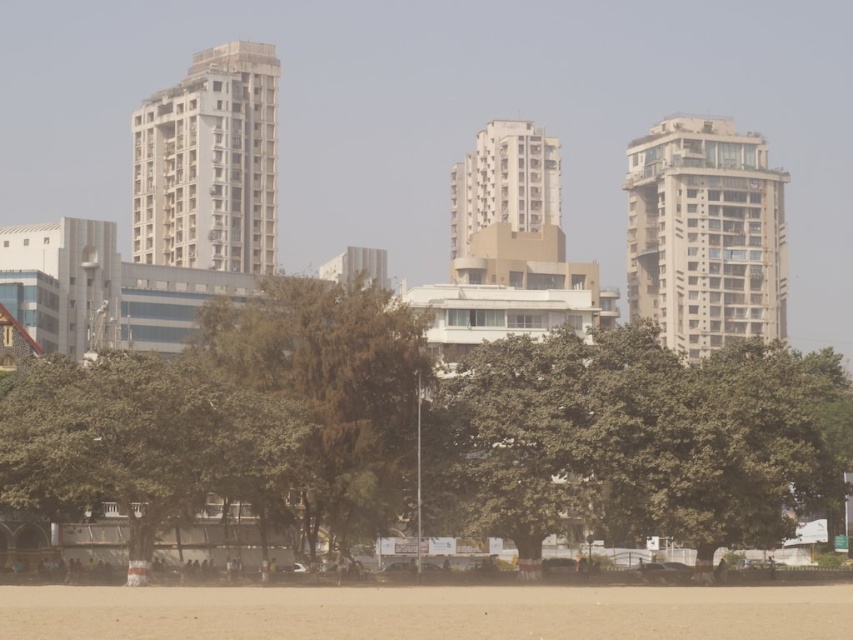
Question: Which object is the farthest from the white concrete building at upper right?

Choices:
 (A) beige concrete building at center
 (B) green leafy tree at center

Answer: (B)

Question: Can you confirm if brown sandy dirt field at lower center is smaller than white concrete building at upper right?

Choices:
 (A) no
 (B) yes

Answer: (B)

Question: Is green leafy tree at center above beige concrete building at center?

Choices:
 (A) no
 (B) yes

Answer: (A)

Question: Which is farther from the white concrete building at center?

Choices:
 (A) brown sandy dirt field at lower center
 (B) beige concrete building at center
 (C) white concrete building at upper right

Answer: (A)

Question: Which point appears closest to the camera in this image?

Choices:
 (A) (741, 154)
 (B) (525, 605)
 (C) (541, 208)
 (D) (131, 120)

Answer: (B)

Question: Observing the image, what is the correct spatial positioning of brown sandy dirt field at lower center in reference to white concrete building at upper right?

Choices:
 (A) below
 (B) above

Answer: (A)